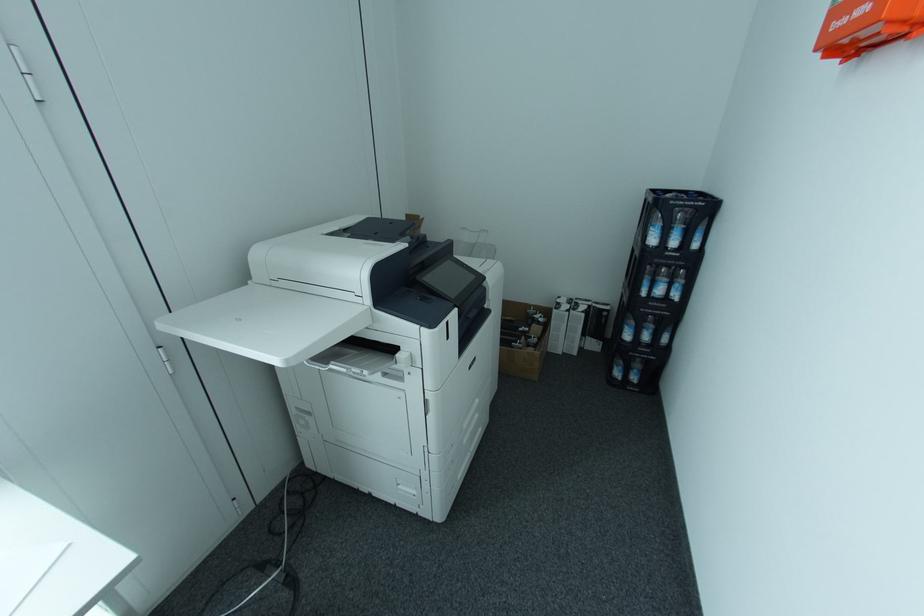
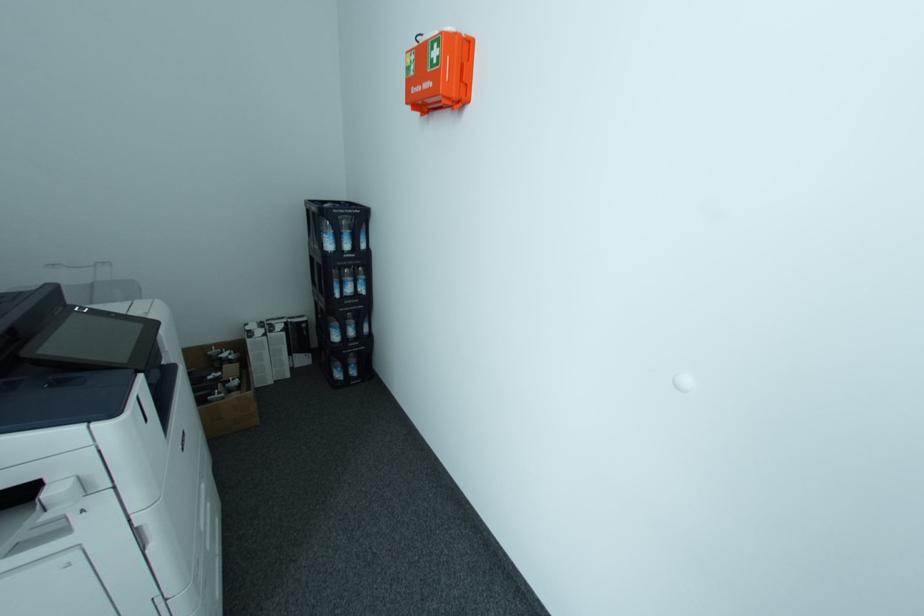
Question: The images are taken continuously from a first-person perspective. In which direction is your viewpoint rotating?

Choices:
 (A) Left
 (B) Right
 (C) Up
 (D) Down

Answer: (B)